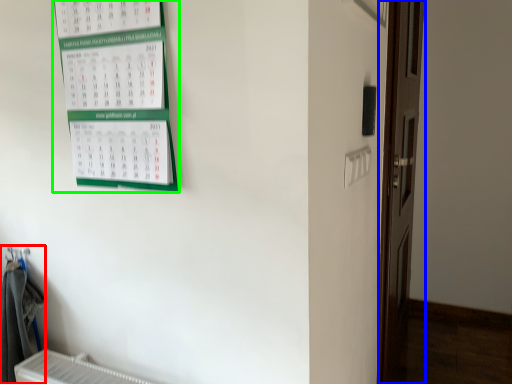
Question: Which object is positioned farthest from laundry (highlighted by a red box)? Select from door (highlighted by a blue box) and bulletin board (highlighted by a green box).

Choices:
 (A) door
 (B) bulletin board

Answer: (A)